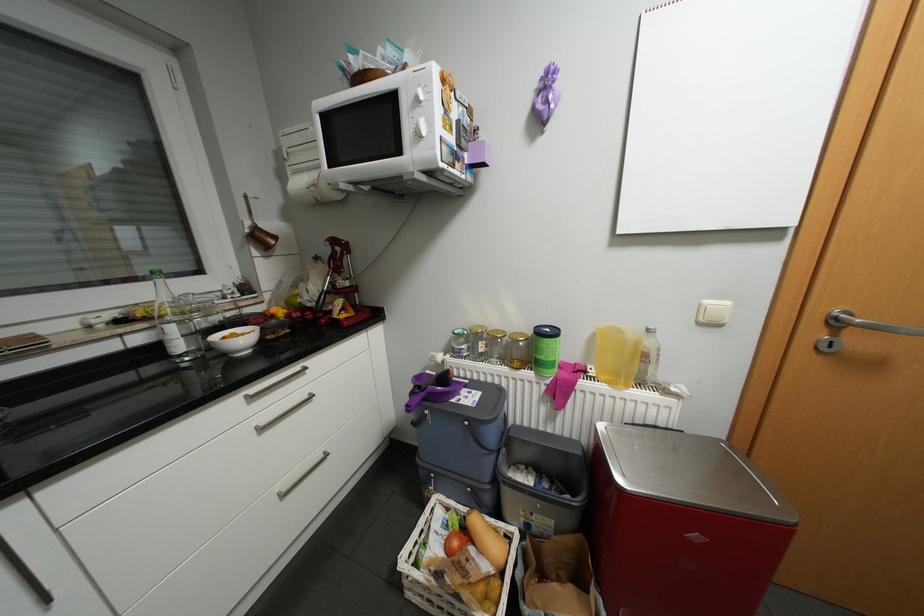
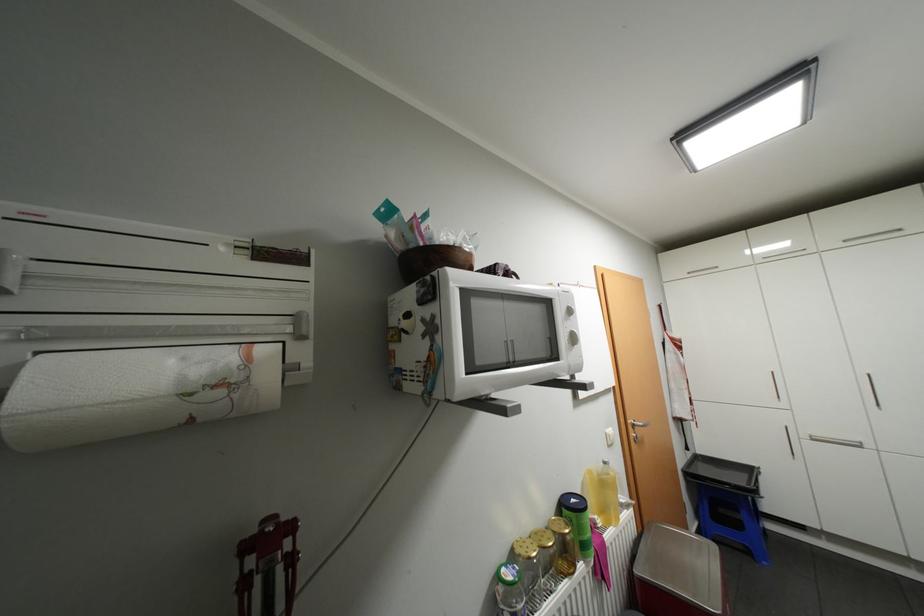
Locate, in the second image, the point that corresponds to point (464, 331) in the first image.

(518, 576)